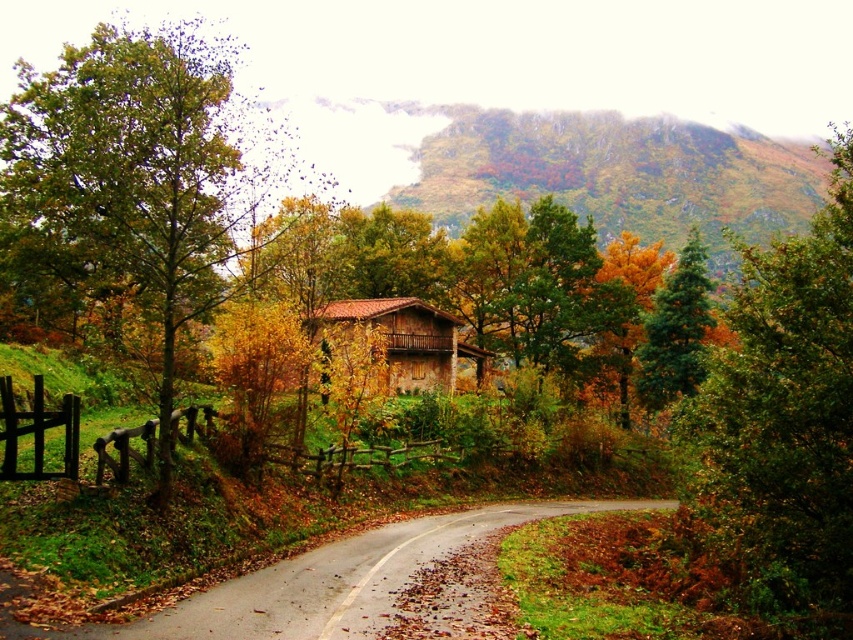
Question: Is green mossy hillside at upper center positioned at the back of green matte tree at upper center?

Choices:
 (A) no
 (B) yes

Answer: (B)

Question: Is green matte tree at center to the right of green mossy hillside at upper center from the viewer's perspective?

Choices:
 (A) yes
 (B) no

Answer: (B)

Question: Which point is farther to the camera?

Choices:
 (A) green matte tree at center
 (B) wet asphalt road at center

Answer: (A)

Question: Which object is the closest to the green leafy tree at upper right?

Choices:
 (A) green matte tree at upper center
 (B) brown stone house at center

Answer: (A)

Question: Considering the relative positions of wet asphalt road at center and green matte tree at upper center in the image provided, where is wet asphalt road at center located with respect to green matte tree at upper center?

Choices:
 (A) above
 (B) below

Answer: (B)

Question: Which point is closer to the camera?

Choices:
 (A) (91, 628)
 (B) (437, 317)
 (C) (489, 128)

Answer: (A)